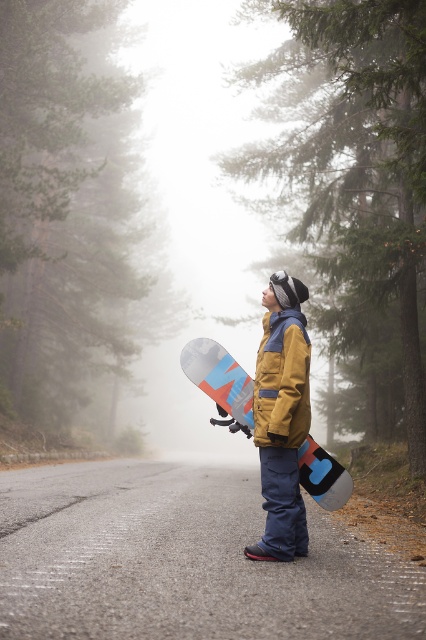
Question: Does yellow fabric snowboarder at center have a lesser width compared to matte blue snowboard at center?

Choices:
 (A) no
 (B) yes

Answer: (B)

Question: Which point is farther from the camera taking this photo?

Choices:
 (A) (198, 352)
 (B) (302, 323)

Answer: (A)

Question: Does yellow fabric snowboarder at center appear on the right side of matte blue snowboard at center?

Choices:
 (A) no
 (B) yes

Answer: (B)

Question: Does yellow fabric snowboarder at center have a larger size compared to matte blue snowboard at center?

Choices:
 (A) no
 (B) yes

Answer: (B)

Question: Which point is closer to the camera?

Choices:
 (A) matte blue snowboard at center
 (B) yellow fabric snowboarder at center

Answer: (B)